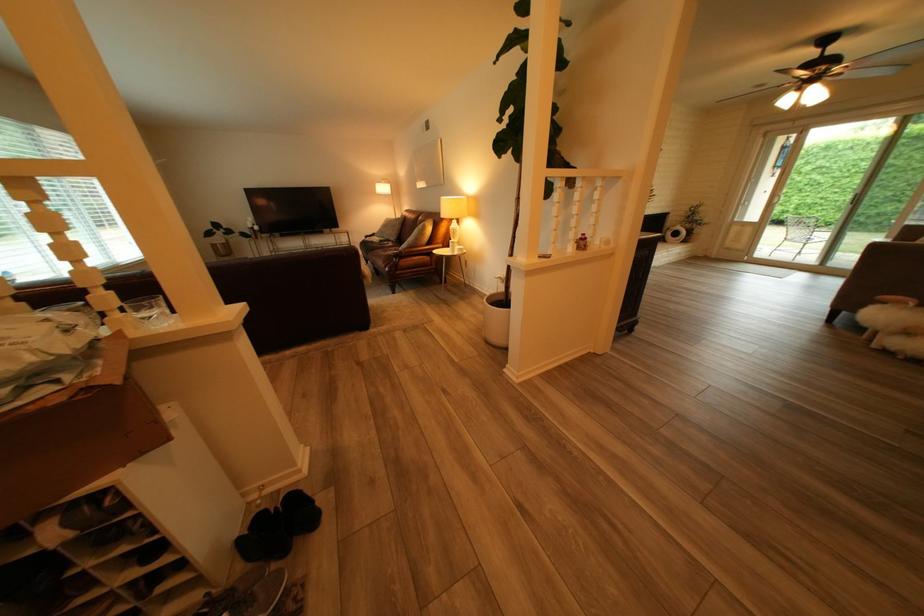
Image resolution: width=924 pixels, height=616 pixels. I want to click on brown leather sofa armrest, so click(417, 254).